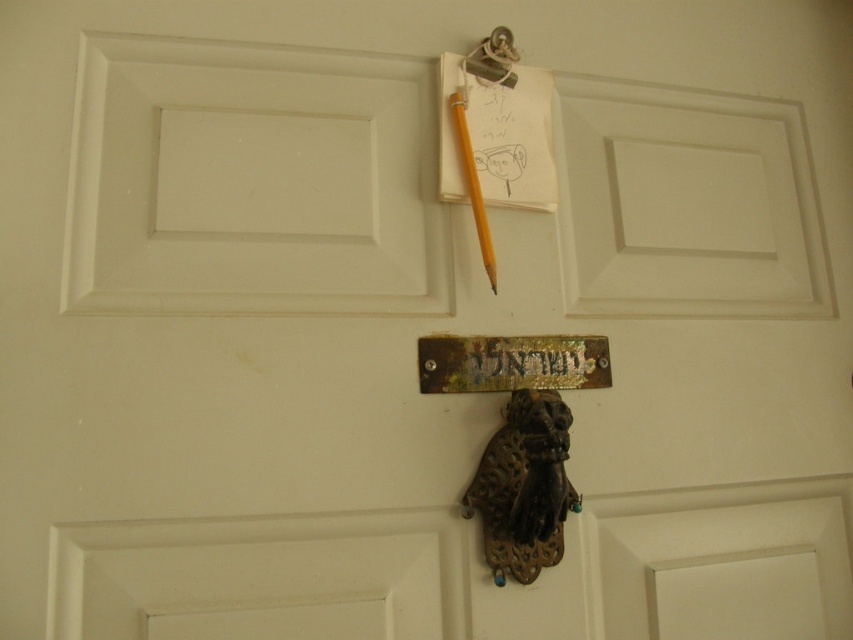
You are a delivery person trying to reach the doorbell. You see the antique brass knocker at center and the rusty metal sign at center. Which one is closer to you?

The antique brass knocker at center and rusty metal sign at center are 10.40 centimeters apart from each other, so you need to check their positions to determine which is closer. However, the description does not specify which is in front or behind, only the distance between them. Without additional information on their arrangement, it is unclear which is closer.

You are a delivery person who needs to hang a package on the door. The package is too heavy to hold, so you must use the metallic hook at upper center. However, there is a rusty metal sign at center nearby. Can you hang the package on the hook without knocking over the sign?

The rusty metal sign at center is to the right of the metallic hook at upper center, so hanging the package on the metallic hook at upper center should not knock over the rusty metal sign at center as they are positioned side by side horizontally.

You are a delivery person trying to hang a package receipt on the door. The receipt is as wide as the yellow wood pencil at center. Can you fit it on the metallic hook at upper center without bending it?

The yellow wood pencil at center has a lesser width compared to metallic hook at upper center, so the receipt can fit on the metallic hook at upper center without bending it since the hook is wider.